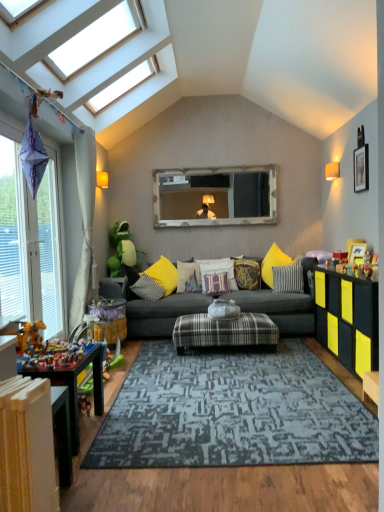
Describe the element at coordinates (102, 179) in the screenshot. I see `matte yellow wall sconce at upper right, the 1th lamp viewed from the left` at that location.

The image size is (384, 512). Find the location of `wooden toy at lower left, which is counted as the second table, starting from the bottom`. wooden toy at lower left, which is counted as the second table, starting from the bottom is located at coordinates (8, 356).

This screenshot has height=512, width=384. In order to click on beige fabric curtain at left in this screenshot , I will do `click(84, 221)`.

What do you see at coordinates (84, 221) in the screenshot? The height and width of the screenshot is (512, 384). I see `beige fabric curtain at left` at bounding box center [84, 221].

Image resolution: width=384 pixels, height=512 pixels. Describe the element at coordinates (122, 249) in the screenshot. I see `green plush toy at center, the 1th toy when ordered from top to bottom` at that location.

Describe the element at coordinates (218, 270) in the screenshot. I see `white cotton pillow at center, the 3th pillow in the right-to-left sequence` at that location.

Measure the distance between point (202, 278) and camera.

They are 16.84 feet apart.

This screenshot has width=384, height=512. What do you see at coordinates (280, 309) in the screenshot?
I see `dark gray fabric couch at center` at bounding box center [280, 309].

Where is `dark gray fabric couch at center`? The height and width of the screenshot is (512, 384). dark gray fabric couch at center is located at coordinates coord(280,309).

Where is `matte yellow wall sconce at upper right, the 1th lamp viewed from the left`? matte yellow wall sconce at upper right, the 1th lamp viewed from the left is located at coordinates (102, 179).

Is point (267, 293) positioned in front of point (358, 185)?

That is False.

From a real-world perspective, relative to black matte picture frame at upper right, the 1th picture frame viewed from the right, is dark gray fabric couch at center vertically above or below?

Clearly, from a real-world perspective, dark gray fabric couch at center is below black matte picture frame at upper right, the 1th picture frame viewed from the right.

Who is shorter, dark gray fabric couch at center or black matte picture frame at upper right, marked as the second picture frame in a bottom-to-top arrangement?

black matte picture frame at upper right, marked as the second picture frame in a bottom-to-top arrangement, is shorter.

From the image's perspective, is dark gray fabric couch at center located above or below black matte picture frame at upper right, marked as the second picture frame in a bottom-to-top arrangement?

Based on their image positions, dark gray fabric couch at center is located beneath black matte picture frame at upper right, marked as the second picture frame in a bottom-to-top arrangement.

From the picture: Is dark gray fabric couch at center bigger or smaller than multicolored plastic toys at lower left, which is the first toy from bottom to top?

In the image, dark gray fabric couch at center appears to be larger than multicolored plastic toys at lower left, which is the first toy from bottom to top.

Could you tell me if dark gray fabric couch at center is turned towards multicolored plastic toys at lower left, marked as the first toy in a front-to-back arrangement?

Yes, dark gray fabric couch at center is aimed at multicolored plastic toys at lower left, marked as the first toy in a front-to-back arrangement.

Can you confirm if dark gray fabric couch at center is wider than multicolored plastic toys at lower left, the 2th toy from the top?

Yes, dark gray fabric couch at center is wider than multicolored plastic toys at lower left, the 2th toy from the top.

Visually, is gray striped pillow at center, which is the first pillow from right to left, positioned to the left or to the right of matte yellow wall sconce at upper right, which ranks as the 2th lamp in left-to-right order?

Clearly, gray striped pillow at center, which is the first pillow from right to left, is on the left of matte yellow wall sconce at upper right, which ranks as the 2th lamp in left-to-right order, in the image.

From the picture: From a real-world perspective, is gray striped pillow at center, arranged as the 6th pillow when viewed from the left, located beneath matte yellow wall sconce at upper right, marked as the first lamp in a right-to-left arrangement?

Yes.

From the image's perspective, is gray striped pillow at center, arranged as the 6th pillow when viewed from the left, located above matte yellow wall sconce at upper right, which ranks as the 2th lamp in left-to-right order?

No, from the image's perspective, gray striped pillow at center, arranged as the 6th pillow when viewed from the left, is not over matte yellow wall sconce at upper right, which ranks as the 2th lamp in left-to-right order.

From the picture: Is gray striped pillow at center, arranged as the 6th pillow when viewed from the left, in contact with matte yellow wall sconce at upper right, which ranks as the 2th lamp in left-to-right order?

No, gray striped pillow at center, arranged as the 6th pillow when viewed from the left, is not making contact with matte yellow wall sconce at upper right, which ranks as the 2th lamp in left-to-right order.

Is matte yellow wall sconce at upper right, marked as the first lamp in a right-to-left arrangement, smaller than dark gray fabric couch at center?

Yes, matte yellow wall sconce at upper right, marked as the first lamp in a right-to-left arrangement, is smaller than dark gray fabric couch at center.

Would you consider matte yellow wall sconce at upper right, marked as the first lamp in a right-to-left arrangement, to be distant from dark gray fabric couch at center?

Yes.

Would you say matte yellow wall sconce at upper right, which ranks as the 2th lamp in left-to-right order, is to the left or to the right of dark gray fabric couch at center in the picture?

Clearly, matte yellow wall sconce at upper right, which ranks as the 2th lamp in left-to-right order, is on the right of dark gray fabric couch at center in the image.

From the image's perspective, which one is positioned lower, matte yellow wall sconce at upper right, marked as the first lamp in a right-to-left arrangement, or dark gray fabric couch at center?

dark gray fabric couch at center.

Can you confirm if yellow matte cabinet at right is positioned to the left of beige fabric curtain at left?

In fact, yellow matte cabinet at right is to the right of beige fabric curtain at left.

Does yellow matte cabinet at right have a greater width compared to beige fabric curtain at left?

Indeed, yellow matte cabinet at right has a greater width compared to beige fabric curtain at left.

Is beige fabric curtain at left at the back of yellow matte cabinet at right?

No, beige fabric curtain at left is not at the back of yellow matte cabinet at right.

Is point (320, 325) behind point (90, 181)?

No, it is not.

Considering the relative sizes of white painted wood radiator at lower left and green plush toy at center, placed as the 2th toy when sorted from bottom to top, in the image provided, is white painted wood radiator at lower left smaller than green plush toy at center, placed as the 2th toy when sorted from bottom to top,?

Yes, white painted wood radiator at lower left is smaller than green plush toy at center, placed as the 2th toy when sorted from bottom to top.

Find the location of `radiator located in front of the green plush toy at center, the 1th toy when ordered from top to bottom`. radiator located in front of the green plush toy at center, the 1th toy when ordered from top to bottom is located at coordinates (27, 449).

Is white painted wood radiator at lower left to the right of green plush toy at center, the first toy from the back, from the viewer's perspective?

Indeed, white painted wood radiator at lower left is positioned on the right side of green plush toy at center, the first toy from the back.

From the image's perspective, is white painted wood radiator at lower left located above green plush toy at center, placed as the 2th toy when sorted from bottom to top?

No.

Can you confirm if green plush toy at center, placed as the 2th toy when sorted from bottom to top, is bigger than black matte picture frame at upper right, arranged as the 1th picture frame when viewed from the top?

Correct, green plush toy at center, placed as the 2th toy when sorted from bottom to top, is larger in size than black matte picture frame at upper right, arranged as the 1th picture frame when viewed from the top.

Can you confirm if green plush toy at center, which ranks as the second toy in front-to-back order, is positioned to the left of black matte picture frame at upper right, arranged as the second picture frame when viewed from the left?

Yes, green plush toy at center, which ranks as the second toy in front-to-back order, is to the left of black matte picture frame at upper right, arranged as the second picture frame when viewed from the left.

Is green plush toy at center, placed as the 2th toy when sorted from bottom to top, not inside black matte picture frame at upper right, the 1th picture frame viewed from the right?

green plush toy at center, placed as the 2th toy when sorted from bottom to top, is positioned outside black matte picture frame at upper right, the 1th picture frame viewed from the right.

Where is `studio couch that appears behind the black matte picture frame at upper right, arranged as the second picture frame when viewed from the left`? studio couch that appears behind the black matte picture frame at upper right, arranged as the second picture frame when viewed from the left is located at coordinates (280, 309).

Identify the location of studio couch on the right of the multicolored plastic toys at lower left, marked as the first toy in a front-to-back arrangement. This screenshot has height=512, width=384. (280, 309).

Looking at the image, which one is located further to matte yellow wall sconce at upper right, the 1th lamp viewed from the left, wooden toy at lower left, which is counted as the second table, starting from the bottom, or purple velvet pillow at center, marked as the 4th pillow in a right-to-left arrangement?

wooden toy at lower left, which is counted as the second table, starting from the bottom, lies further to matte yellow wall sconce at upper right, the 1th lamp viewed from the left, than the other object.

Estimate the real-world distances between objects in this image. Which object is closer to beige fabric curtain at left, white painted wood radiator at lower left or plaid fabric ottoman at center?

The object closer to beige fabric curtain at left is plaid fabric ottoman at center.

Looking at this image, considering their positions, is dark gray fabric couch at center positioned further to matte gray plastic table at lower left, the 1th table from the back, than transparent paper hanging at left, the 2th window positioned from the top?

dark gray fabric couch at center.

From the image, which object appears to be farther from multicolored plastic toys at lower left, the 2th toy from the top, gold textured pillow at center, the fifth pillow viewed from the left, or white cotton pillow at center, the 3th pillow in the right-to-left sequence?

Based on the image, gold textured pillow at center, the fifth pillow viewed from the left, appears to be further to multicolored plastic toys at lower left, the 2th toy from the top.

Considering their positions, is beige fabric curtain at left positioned closer to matte yellow wall sconce at upper right, marked as the first lamp in a right-to-left arrangement, than plaid fabric ottoman at center?

Among the two, plaid fabric ottoman at center is located nearer to matte yellow wall sconce at upper right, marked as the first lamp in a right-to-left arrangement.

Based on their spatial positions, is green plush toy at center, placed as the 2th toy when sorted from bottom to top, or yellow matte cabinet at right closer to yellow fabric pillow at center, positioned as the first pillow in left-to-right order?

green plush toy at center, placed as the 2th toy when sorted from bottom to top, is positioned closer to the anchor yellow fabric pillow at center, positioned as the first pillow in left-to-right order.

Considering their positions, is matte yellow wall sconce at upper right, which ranks as the 2th lamp in left-to-right order, positioned further to dark gray fabric couch at center than wooden picture frame at right, arranged as the 1th picture frame when viewed from the left?

Among the two, matte yellow wall sconce at upper right, which ranks as the 2th lamp in left-to-right order, is located further to dark gray fabric couch at center.

Based on the photo, which object lies nearer to the anchor point wooden picture frame at right, positioned as the first picture frame in bottom-to-top order, yellow fabric pillow at center, positioned as the first pillow in left-to-right order, or wooden frame mirror at center?

Based on the image, yellow fabric pillow at center, positioned as the first pillow in left-to-right order, appears to be nearer to wooden picture frame at right, positioned as the first picture frame in bottom-to-top order.

You are a GUI agent. You are given a task and a screenshot of the screen. Output one action in this format:
    pyautogui.click(x=<x>, y=<y>)
    Task: Click on the window screen situated between transparent paper hanging at left, marked as the 1th window in a bottom-to-top arrangement, and wooden picture frame at right, arranged as the 1th picture frame when viewed from the left, from left to right
    The width and height of the screenshot is (384, 512).
    Given the screenshot: What is the action you would take?
    pyautogui.click(x=215, y=196)

Find the location of a particular element. lamp between transparent paper hanging at left, positioned as the 1th window in left-to-right order, and gray striped pillow at center, which is the first pillow from right to left, in the horizontal direction is located at coordinates (102, 179).

At what (x,y) coordinates should I click in order to perform the action: click on picture frame between yellow fabric pillow at center, positioned as the first pillow in left-to-right order, and matte yellow wall sconce at upper right, marked as the first lamp in a right-to-left arrangement, from left to right. Please return your answer as a coordinate pair (x, y). Looking at the image, I should click on (357, 252).

Locate an element on the screen. The image size is (384, 512). studio couch between matte gray plastic table at lower left, the 1th table from the back, and gold textured pillow at center, the fifth pillow viewed from the left, in the horizontal direction is located at coordinates pyautogui.click(x=280, y=309).